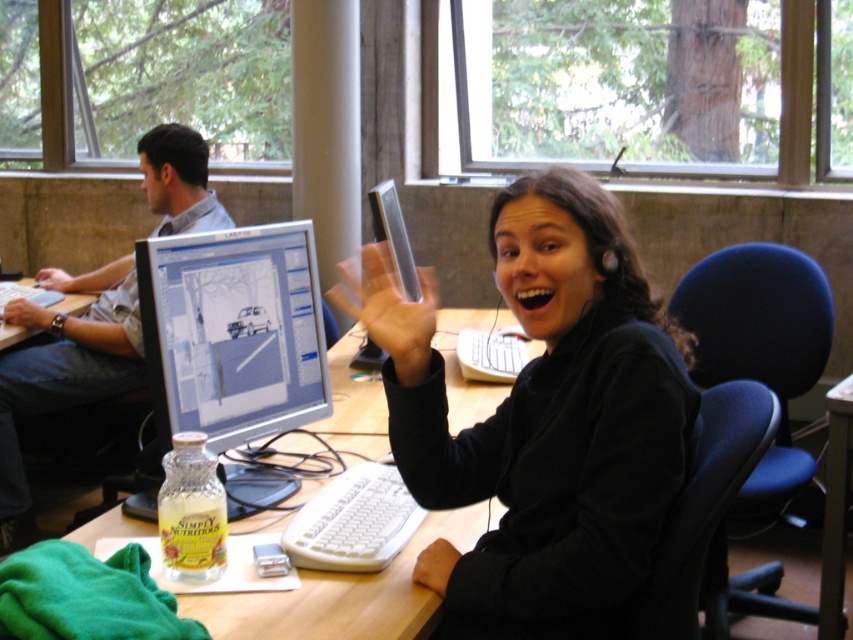
You are a new employee in the office and need to locate the silver metallic monitor at center and the matte gray shirt at left. Based on the scene description, which object is positioned lower in the workspace?

The silver metallic monitor at center is positioned below the matte gray shirt at left, so it is lower in the workspace.

You are a delivery person who just arrived at the office. You need to place a new pair of black matte headphones at upper center on the desk without blocking the silver metallic monitor at center. Where should you place them?

The black matte headphones at upper center should be placed in front of the silver metallic monitor at center so they do not block the monitor.

You are setting up a new desk arrangement and want to place the black matte headphones at upper center and the silver metallic monitor at center on your desk. Considering their sizes, which object should you place first to ensure they both fit properly?

The black matte headphones at upper center might be wider than the silver metallic monitor at center, so you should place the silver metallic monitor at center first to accommodate the wider headphones.